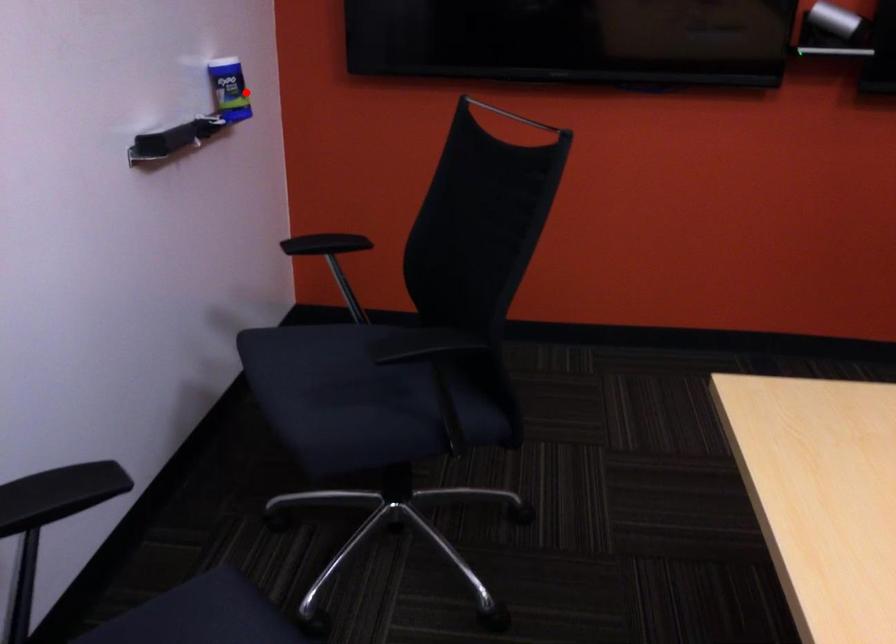
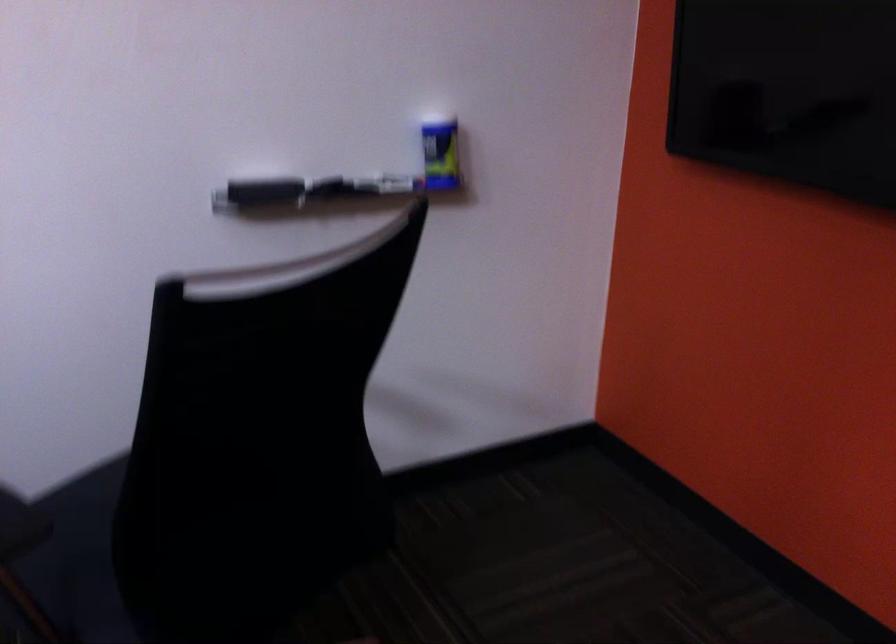
The point at the highlighted location is marked in the first image. Where is the corresponding point in the second image?

(440, 156)